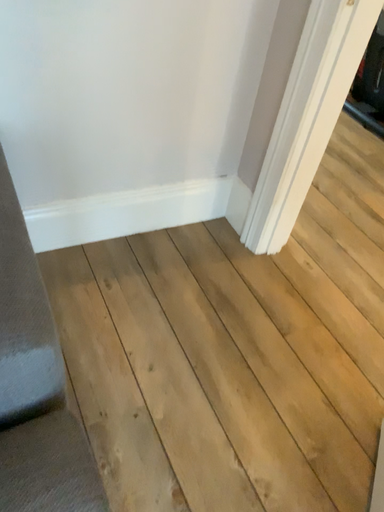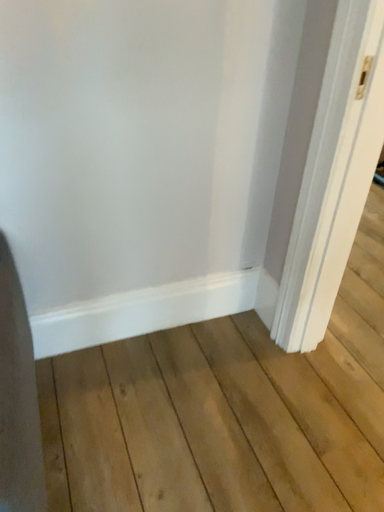
Question: How did the camera likely rotate when shooting the video?

Choices:
 (A) rotated right
 (B) rotated left

Answer: (B)